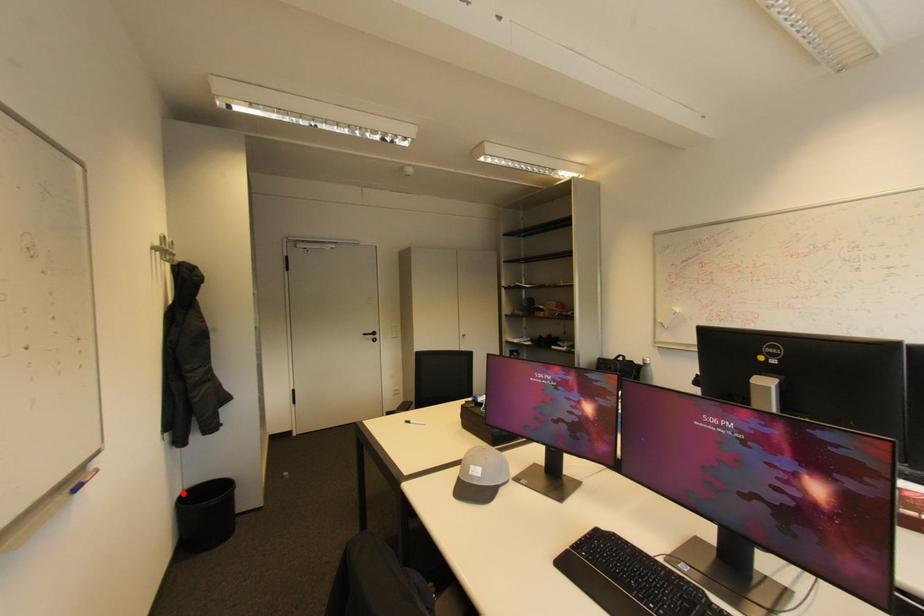
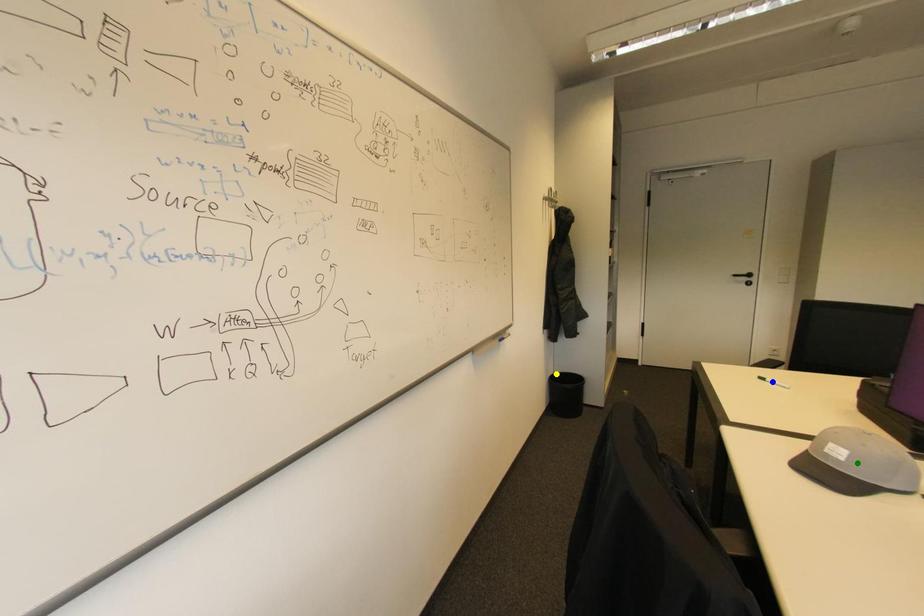
Question: I am providing you with two images of the same scene from different viewpoints. A red point is marked on the first image. You are given multiple points on the second image. In image 2, which mark is for the same physical point as the one in image 1?

Choices:
 (A) yellow point
 (B) blue point
 (C) green point

Answer: (A)